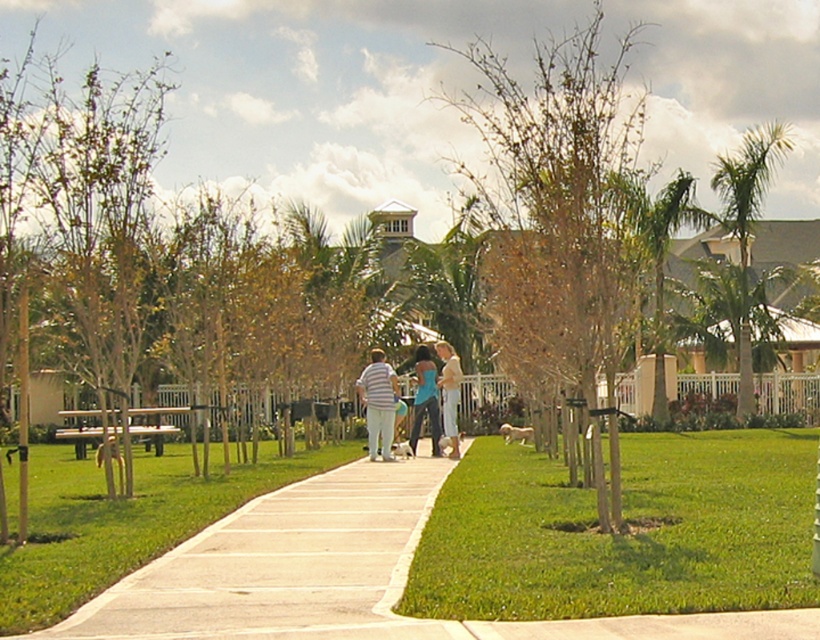
Between striped cotton shirt at center and teal fabric tank top at center, which one is positioned lower?

teal fabric tank top at center

Is striped cotton shirt at center smaller than teal fabric tank top at center?

Yes.

Describe the element at coordinates (377, 403) in the screenshot. I see `striped cotton shirt at center` at that location.

At what (x,y) coordinates should I click in order to perform the action: click on striped cotton shirt at center. Please return your answer as a coordinate pair (x, y). This screenshot has width=820, height=640. Looking at the image, I should click on (377, 403).

Which is above, green leafy palm tree at right or teal fabric tank top at center?

green leafy palm tree at right

Is green leafy palm tree at right behind teal fabric tank top at center?

That is True.

This screenshot has height=640, width=820. In order to click on green leafy palm tree at right in this screenshot , I will do `click(746, 225)`.

Between green grass at lower right and brown leafy tree at center, which one appears on the left side from the viewer's perspective?

From the viewer's perspective, green grass at lower right appears more on the left side.

Between point (804, 596) and point (634, 28), which one is positioned behind?

Point (634, 28)

Where is `green grass at lower right`? This screenshot has width=820, height=640. green grass at lower right is located at coordinates (622, 534).